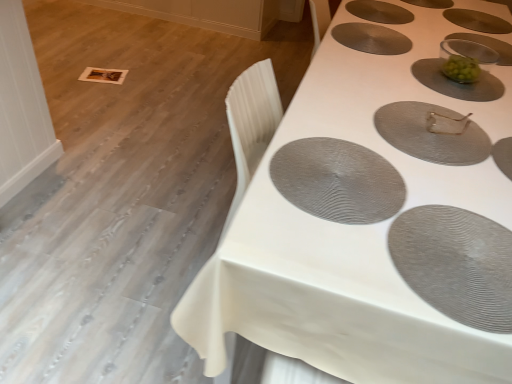
This screenshot has width=512, height=384. Find the location of `vacant space that is in between gray textured placemat at lower right, the first oval from the front, and matte gray placemat at center, which is the fifth oval in back-to-front order`. vacant space that is in between gray textured placemat at lower right, the first oval from the front, and matte gray placemat at center, which is the fifth oval in back-to-front order is located at coordinates (458, 182).